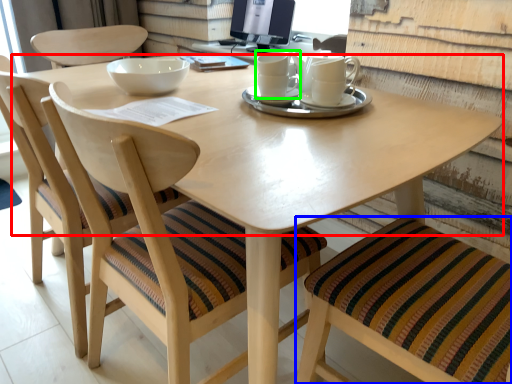
Question: Which is nearer to the round table (highlighted by a red box)? chair (highlighted by a blue box) or coffee cup (highlighted by a green box).

Choices:
 (A) chair
 (B) coffee cup

Answer: (B)